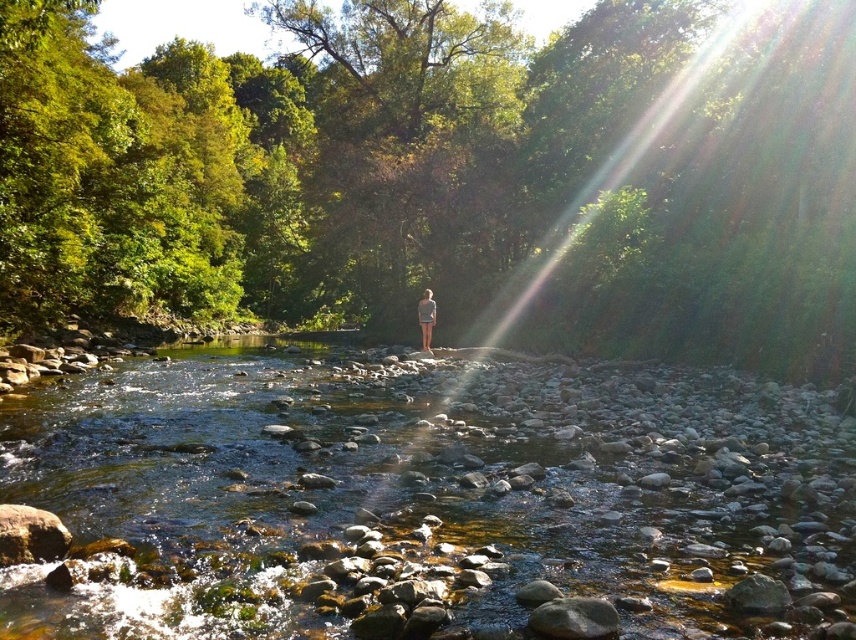
You are standing at the edge of the river and want to take a photo of the point at coordinates point (x=819, y=1). If your camera has a maximum focus range of 20 meters, will it be able to focus on that point?

The distance of point (x=819, y=1) from camera is 22.99 meters, so the camera cannot focus on that point since it exceeds the maximum focus range of 20 meters.

You are a photographer trying to capture a shot of the light blue denim shorts at center and the green leafy tree at center. From the photographer vantage point, which object is positioned to the left?

The green leafy tree at center is positioned to the left of the light blue denim shorts at center.

You are a photographer trying to capture the light blue denim shorts at center and the green leafy tree at center in a single frame. Which object will appear wider in the photo?

The green leafy tree at center will appear wider in the photo since its width surpasses that of the light blue denim shorts at center.